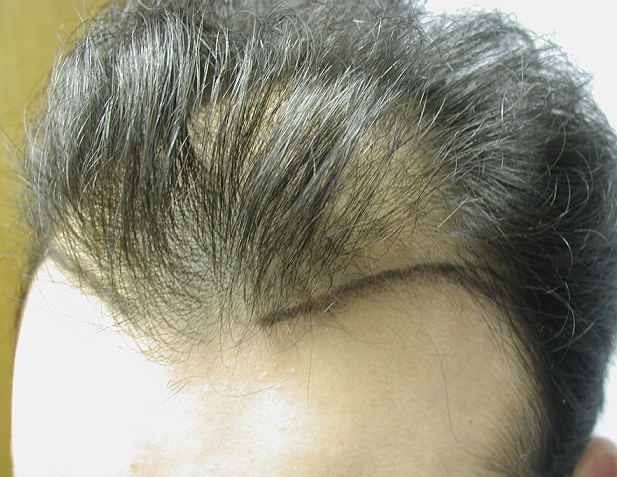
I want to click on wall, so click(x=39, y=38).